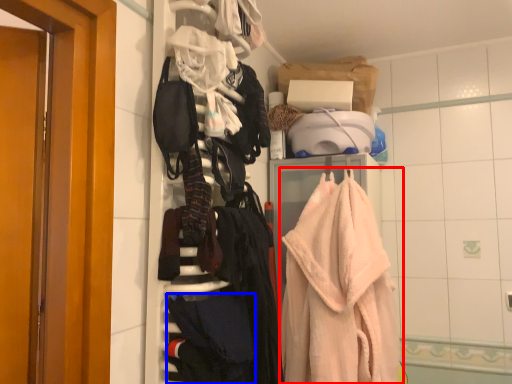
Question: Among these objects, which one is farthest to the camera, towel (highlighted by a red box) or clothing (highlighted by a blue box)?

Choices:
 (A) towel
 (B) clothing

Answer: (A)